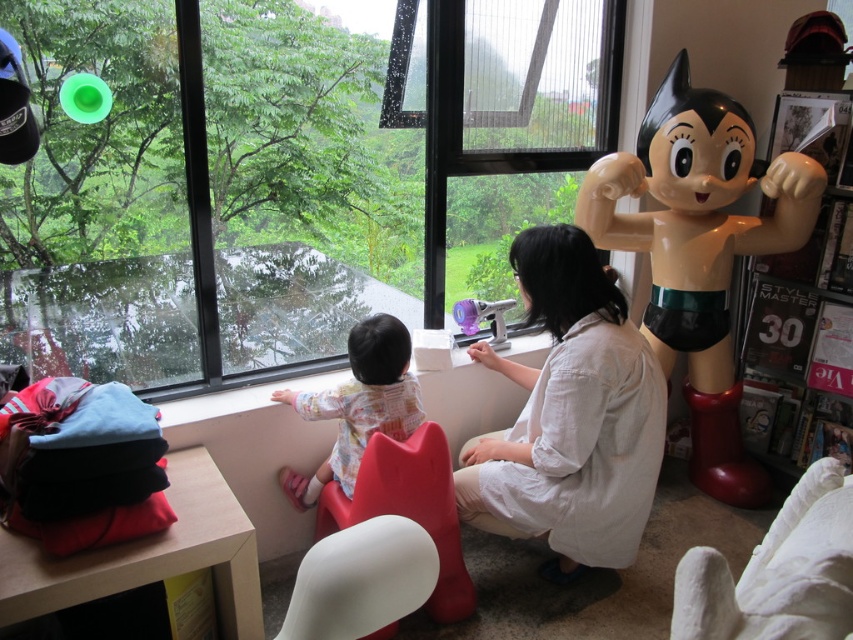
Question: Can you confirm if glossy plastic astro boy at right is positioned above matte plastic chair at lower center?

Choices:
 (A) no
 (B) yes

Answer: (B)

Question: Estimate the real-world distances between objects in this image. Which object is closer to the fluffy pink plush at lower center?

Choices:
 (A) white plastic chair at lower center
 (B) matte plastic chair at lower center

Answer: (B)

Question: Considering the relative positions of transparent glass window at upper center and matte plastic chair at lower center in the image provided, where is transparent glass window at upper center located with respect to matte plastic chair at lower center?

Choices:
 (A) below
 (B) above

Answer: (B)

Question: Is matte plastic chair at lower center wider than fluffy pink plush at lower center?

Choices:
 (A) no
 (B) yes

Answer: (B)

Question: Which object is closer to the camera taking this photo?

Choices:
 (A) white plastic chair at lower center
 (B) matte plastic chair at lower center

Answer: (A)

Question: Which object appears farthest from the camera in this image?

Choices:
 (A) white plastic chair at lower center
 (B) matte plastic chair at lower center
 (C) fluffy pink plush at lower center
 (D) transparent glass window at upper center

Answer: (D)